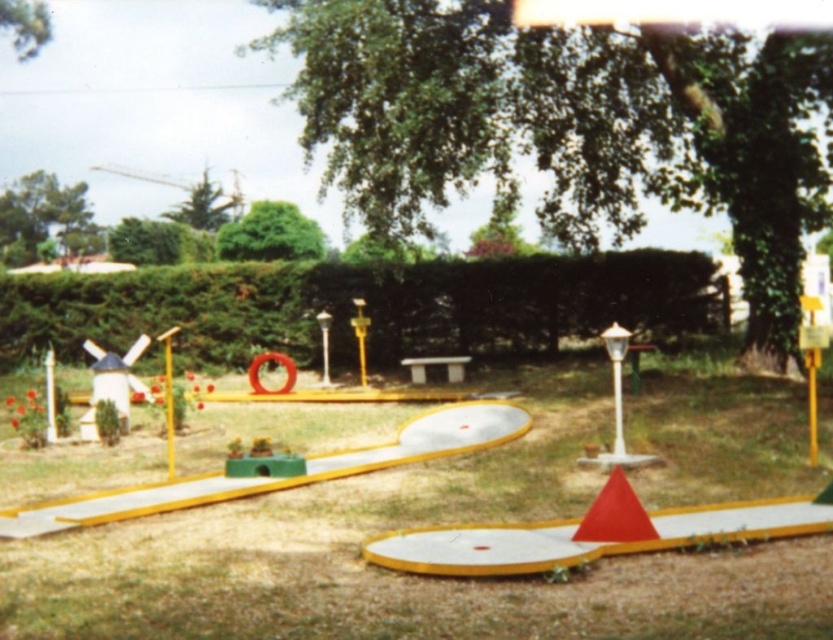
You are playing miniature golf and need to hit the ball around two objects in the center of the course. The objects are the green leafy hedge at center and the metallic pole at center. Which of these two objects do you think is larger in size?

The green leafy hedge at center is bigger than the metallic pole at center, so the green leafy hedge at center is larger in size.

You are standing at the starting position on the miniature golf course and see two points marked on the path to the hole. The first point is at coordinates point (207, 289) and the second point is at point (617, 381). Which point is closer to you as you stand at the starting position?

Point (207, 289) is behind point (617, 381), so the point closer to you is point (617, 381).